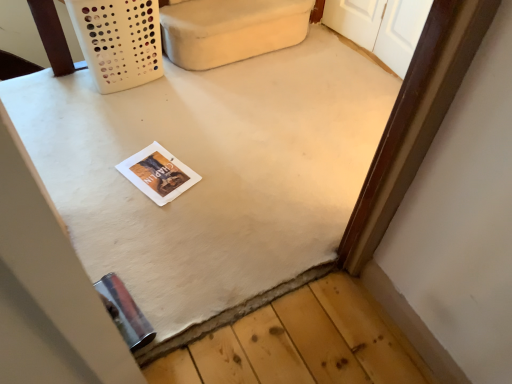
Question: From a real-world perspective, is white paper magazine at center below white fabric couch at upper center?

Choices:
 (A) yes
 (B) no

Answer: (A)

Question: Does white paper magazine at center appear on the right side of white fabric couch at upper center?

Choices:
 (A) no
 (B) yes

Answer: (A)

Question: From the image's perspective, is white paper magazine at center under white fabric couch at upper center?

Choices:
 (A) no
 (B) yes

Answer: (B)

Question: Does white paper magazine at center have a greater width compared to white fabric couch at upper center?

Choices:
 (A) no
 (B) yes

Answer: (B)

Question: From a real-world perspective, does white paper magazine at center stand above white fabric couch at upper center?

Choices:
 (A) no
 (B) yes

Answer: (A)

Question: From the image's perspective, is white paper magazine at center located above or below white matte table at center?

Choices:
 (A) below
 (B) above

Answer: (A)

Question: Based on their positions, is white paper magazine at center located to the left or right of white matte table at center?

Choices:
 (A) left
 (B) right

Answer: (A)

Question: Is white paper magazine at center wider or thinner than white matte table at center?

Choices:
 (A) wide
 (B) thin

Answer: (B)

Question: From a real-world perspective, is white paper magazine at center positioned above or below white matte table at center?

Choices:
 (A) below
 (B) above

Answer: (A)

Question: In the image, is white fabric couch at upper center positioned in front of or behind white paper magazine at center?

Choices:
 (A) front
 (B) behind

Answer: (B)

Question: From the image's perspective, is white fabric couch at upper center above or below white paper magazine at center?

Choices:
 (A) below
 (B) above

Answer: (B)

Question: Considering the positions of white fabric couch at upper center and white paper magazine at center in the image, is white fabric couch at upper center bigger or smaller than white paper magazine at center?

Choices:
 (A) small
 (B) big

Answer: (B)

Question: Does point (175, 8) appear closer or farther from the camera than point (166, 172)?

Choices:
 (A) closer
 (B) farther

Answer: (B)

Question: Looking at the image, does white fabric couch at upper center seem bigger or smaller compared to white matte table at center?

Choices:
 (A) big
 (B) small

Answer: (B)

Question: From a real-world perspective, is white fabric couch at upper center physically located above or below white matte table at center?

Choices:
 (A) below
 (B) above

Answer: (B)